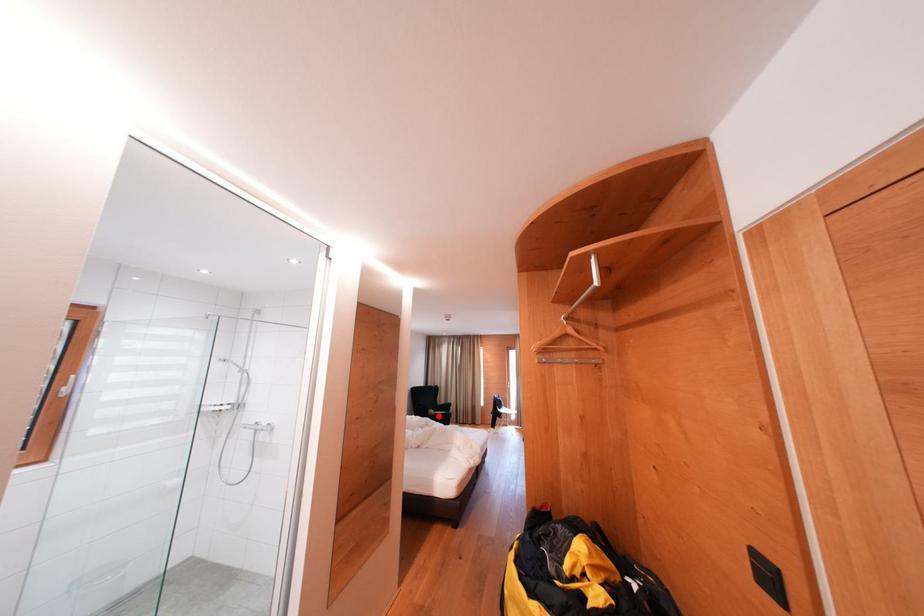
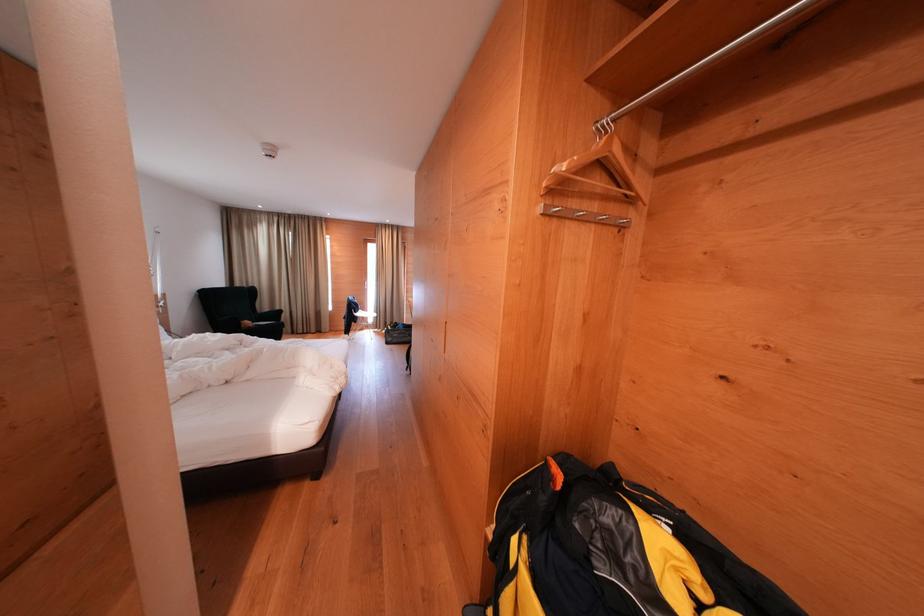
Find the pixel in the second image that matches the highlighted location in the first image.

(254, 328)